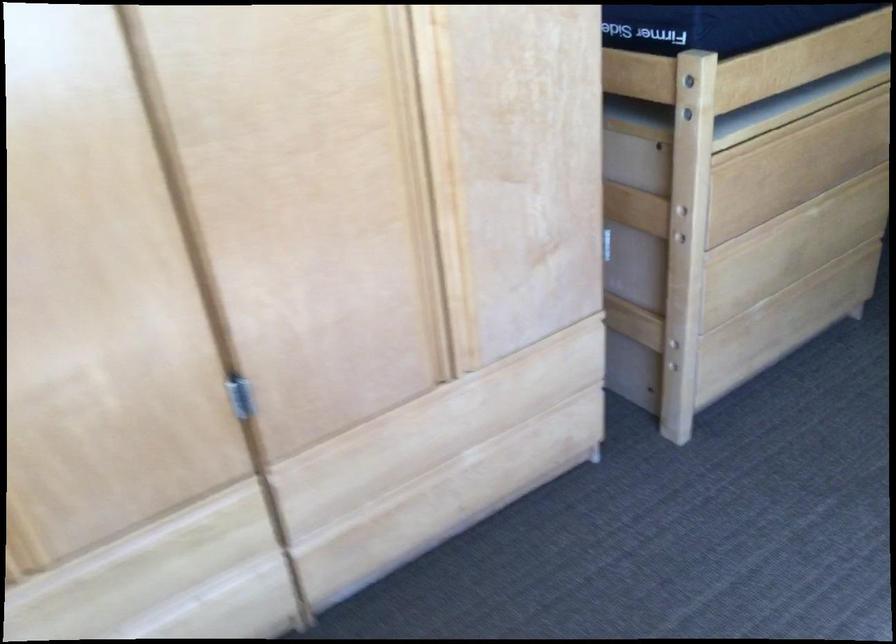
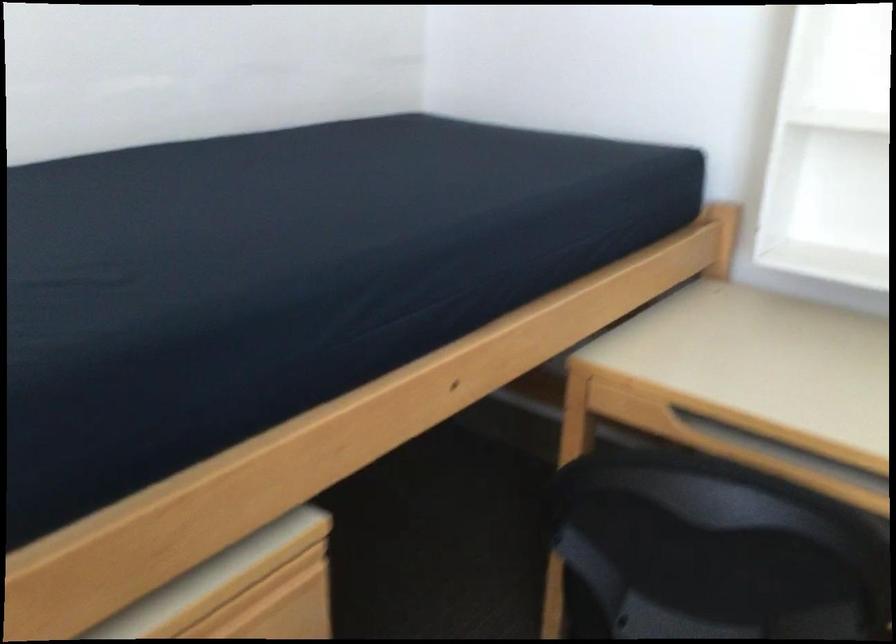
In a continuous first-person perspective shot, in which direction is the camera moving?

The cameraman moved toward right, forward.